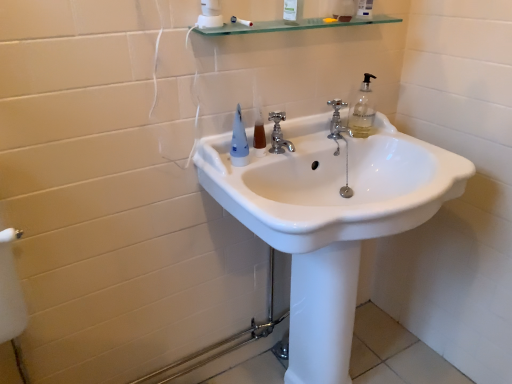
Question: From a real-world perspective, is transparent glass shelf at upper center positioned under matte blue plastic toothbrush at upper center based on gravity?

Choices:
 (A) yes
 (B) no

Answer: (B)

Question: Is matte blue plastic toothbrush at upper center at the back of transparent glass shelf at upper center?

Choices:
 (A) yes
 (B) no

Answer: (B)

Question: Is transparent glass shelf at upper center in contact with matte blue plastic toothbrush at upper center?

Choices:
 (A) yes
 (B) no

Answer: (B)

Question: Does transparent glass shelf at upper center have a larger size compared to matte blue plastic toothbrush at upper center?

Choices:
 (A) no
 (B) yes

Answer: (B)

Question: From a real-world perspective, is transparent glass shelf at upper center physically above matte blue plastic toothbrush at upper center?

Choices:
 (A) yes
 (B) no

Answer: (A)

Question: Considering the relative sizes of transparent glass shelf at upper center and matte blue plastic toothbrush at upper center in the image provided, is transparent glass shelf at upper center smaller than matte blue plastic toothbrush at upper center?

Choices:
 (A) no
 (B) yes

Answer: (A)

Question: Is matte blue plastic toothbrush at upper center at the back of white glossy sink at center?

Choices:
 (A) no
 (B) yes

Answer: (A)

Question: Are white glossy sink at center and matte blue plastic toothbrush at upper center making contact?

Choices:
 (A) no
 (B) yes

Answer: (A)

Question: Is white glossy sink at center not within matte blue plastic toothbrush at upper center?

Choices:
 (A) no
 (B) yes

Answer: (B)

Question: Does white glossy sink at center come in front of matte blue plastic toothbrush at upper center?

Choices:
 (A) no
 (B) yes

Answer: (B)

Question: Considering the relative positions of white glossy sink at center and matte blue plastic toothbrush at upper center in the image provided, is white glossy sink at center to the left of matte blue plastic toothbrush at upper center from the viewer's perspective?

Choices:
 (A) yes
 (B) no

Answer: (B)

Question: From the image's perspective, would you say white glossy sink at center is shown under matte blue plastic toothbrush at upper center?

Choices:
 (A) no
 (B) yes

Answer: (B)

Question: Is translucent plastic mouthwash at center smaller than polished chrome faucet at center, the 1th tap from the left?

Choices:
 (A) no
 (B) yes

Answer: (B)